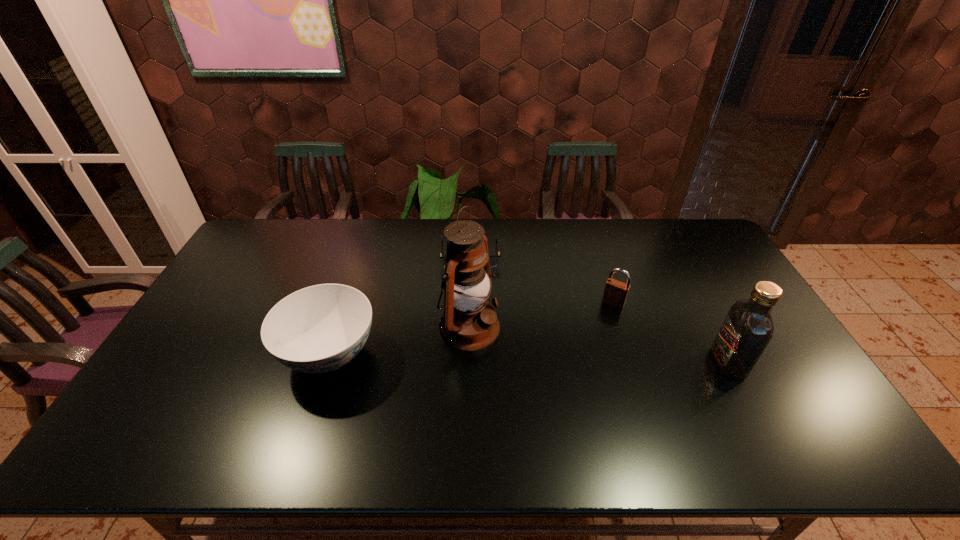
At what (x,y) coordinates should I click in order to perform the action: click on free space located 0.090m on the front-facing side of the rightmost object. Please return your answer as a coordinate pair (x, y). Looking at the image, I should click on (681, 362).

The width and height of the screenshot is (960, 540). I want to click on vacant space located 0.380m on the side of the tallest object, there is a wick adjustment knob, so click(625, 402).

This screenshot has width=960, height=540. What are the coordinates of `vacant area located 0.350m on the side of the tallest object, there is a wick adjustment knob` in the screenshot? It's located at (613, 396).

Where is `free space located on the side of the tallest object, there is a wick adjustment knob`? Image resolution: width=960 pixels, height=540 pixels. free space located on the side of the tallest object, there is a wick adjustment knob is located at coordinates (634, 406).

Image resolution: width=960 pixels, height=540 pixels. Identify the location of free space located on the front-facing side of the shortest object. (472, 314).

Identify the location of vacant point located 0.210m on the front-facing side of the shortest object. The width and height of the screenshot is (960, 540). (472, 314).

At what (x,y) coordinates should I click in order to perform the action: click on vacant space located 0.400m on the front-facing side of the shortest object. Please return your answer as a coordinate pair (x, y). Looking at the image, I should click on (473, 364).

Where is `vacant space located 0.180m on the front-facing side of the padlock`? Image resolution: width=960 pixels, height=540 pixels. vacant space located 0.180m on the front-facing side of the padlock is located at coordinates (587, 346).

Where is `free space located 0.350m on the front-facing side of the padlock`? This screenshot has width=960, height=540. free space located 0.350m on the front-facing side of the padlock is located at coordinates (561, 389).

Where is `vacant point located on the front-facing side of the padlock`? vacant point located on the front-facing side of the padlock is located at coordinates (602, 320).